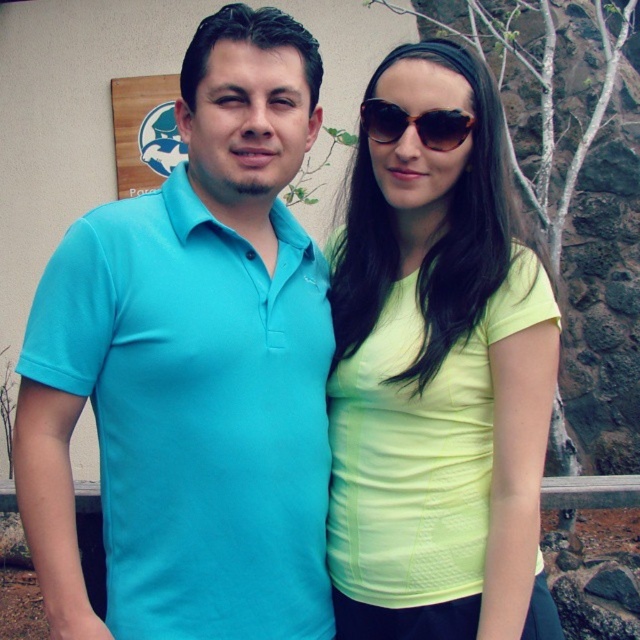
You are a photographer trying to capture a closeup of the neon yellow fabric at center and the brown textured sunglasses at center. Which object should you focus on first if you want to ensure both are in focus without moving the camera?

The neon yellow fabric at center is below the brown textured sunglasses at center, so you should focus on the brown textured sunglasses at center first since it is farther away from the camera. This way, the depth of field will cover both objects more effectively.

You are a photographer setting up for a group photo. You have two subjects in front of you wearing a matte blue polo shirt at left and brown textured sunglasses at center. Based on their heights, which subject should you position closer to the camera to ensure both are in focus?

The matte blue polo shirt at left is much taller than the brown textured sunglasses at center. To ensure both are in focus, position the shorter subject, the brown textured sunglasses at center, closer to the camera.

You are standing in the scene and want to move from the point at coordinates point (132, 481) to the point at coordinates point (387, 141). Which direction should you move to reach your destination?

To move from point (132, 481) to point (387, 141), you should move towards the upper left direction since point (387, 141) is located behind and to the left of point (132, 481).